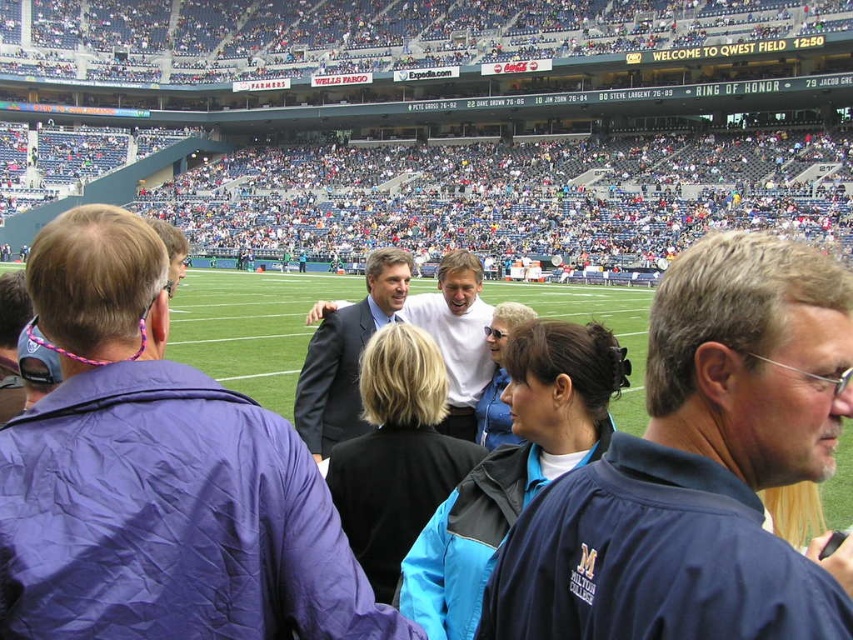
You are a photographer at Qwest Field trying to capture a candid shot of both individuals at point (346,368) and point (440,426). Considering their positions relative to the camera, which individual should you focus on first to ensure they are in sharp focus?

You should focus on the individual at point (346,368) first because they are closer to the camera than the other point (440,426). This ensures the closer subject is in focus before adjusting for the farther one.

You are a photographer at Qwest Field trying to capture a photo of the dark gray suit at center without the blue stadium seats at upper center blocking the view. Based on their heights, is this possible?

The blue stadium seats at upper center are taller than the dark gray suit at center, so they will block the view of the dark gray suit at center unless you position yourself lower or move closer.

You are a photographer at Qwest Field and want to capture a photo of both the blue stadium seats at upper center and the dark gray suit at center in the same frame. Given that your camera has a maximum zoom range of 50 meters, can you fit both objects into the frame?

The distance between the blue stadium seats at upper center and the dark gray suit at center is 50.98 meters. Since your camera can only zoom up to 50 meters, you cannot fit both objects into the frame as the required distance exceeds the camera capability.